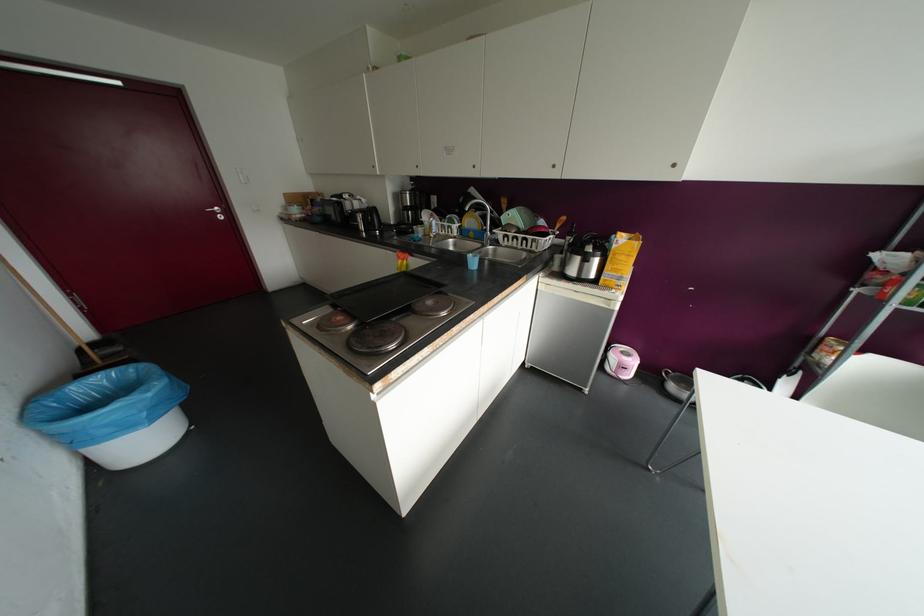
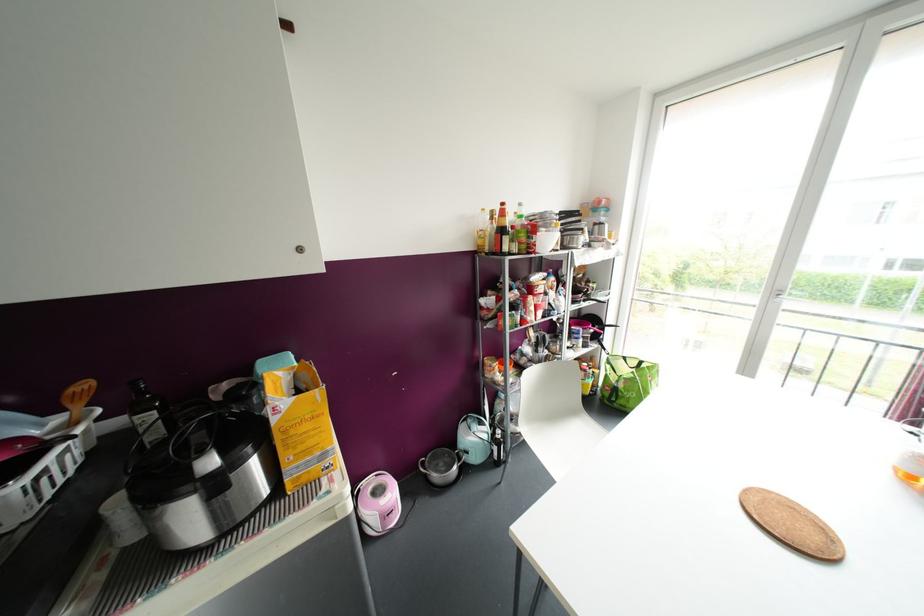
Locate, in the second image, the point that corresponds to (569,238) in the first image.

(150, 416)